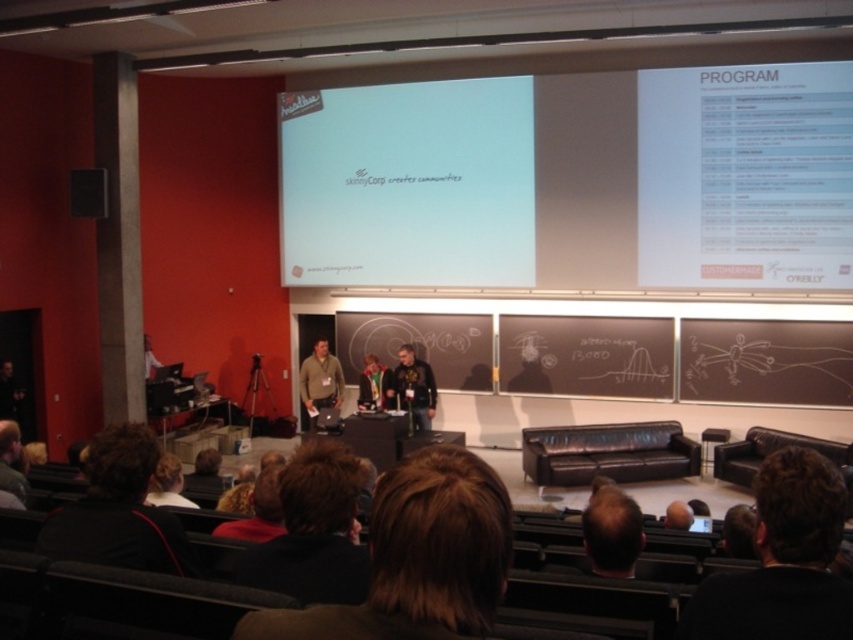
Is white paper at upper center above brown hair at center?

Yes, white paper at upper center is above brown hair at center.

Can you confirm if white paper at upper center is shorter than brown hair at center?

No.

Does point (537, 221) come farther from viewer compared to point (453, 621)?

Yes, it is.

You are a GUI agent. You are given a task and a screenshot of the screen. Output one action in this format:
    pyautogui.click(x=<x>, y=<y>)
    Task: Click on the white paper at upper center
    This screenshot has width=853, height=640.
    Given the screenshot: What is the action you would take?
    pyautogui.click(x=573, y=180)

Locate an element on the screen. The height and width of the screenshot is (640, 853). brown hair at center is located at coordinates (418, 557).

Find the location of `brown hair at center`. brown hair at center is located at coordinates (418, 557).

Identify the location of brown hair at center. (418, 557).

Between point (396, 371) and point (148, 490), which one is positioned in front?

Point (148, 490)

Between point (393, 376) and point (160, 468), which one is positioned behind?

The point (393, 376) is behind.

In order to click on black leather jacket at center in this screenshot , I will do `click(413, 387)`.